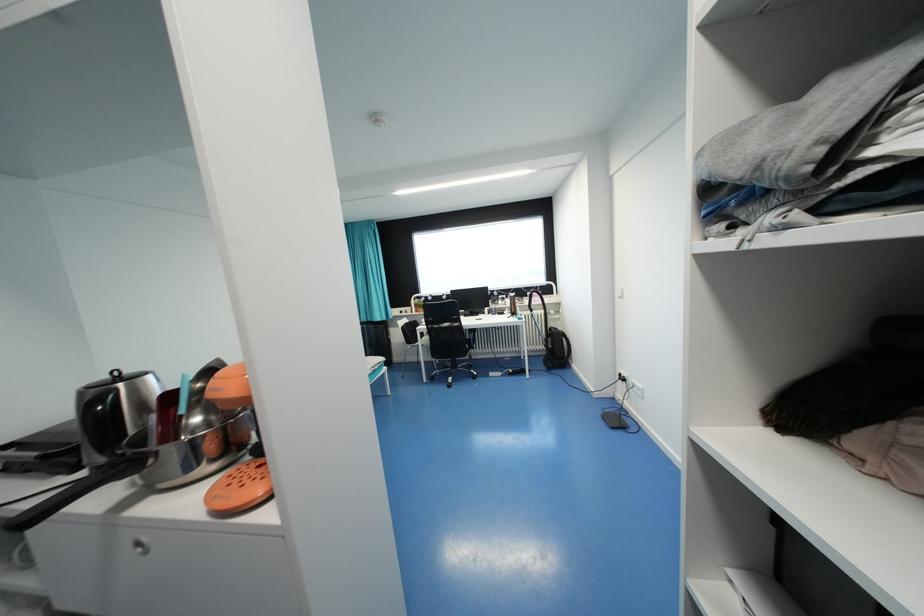
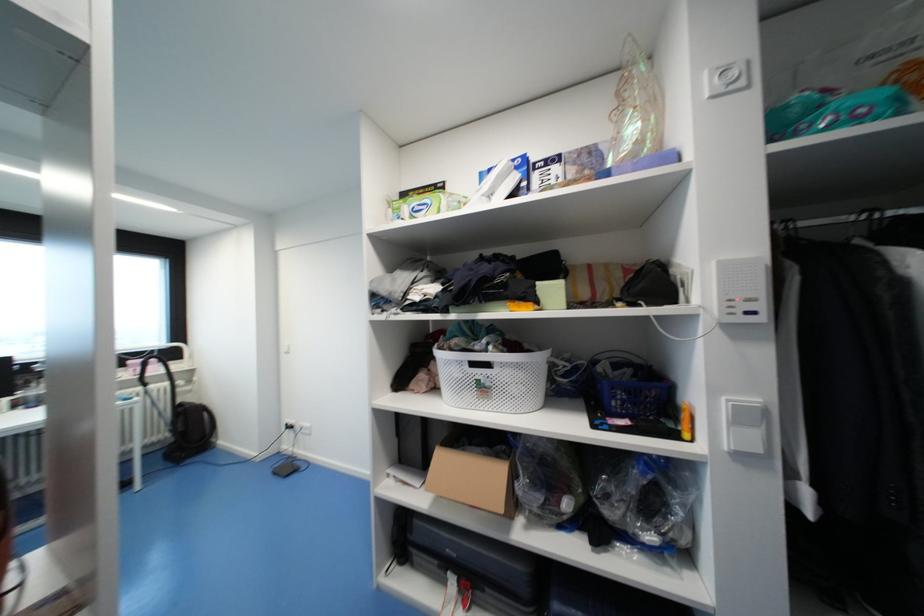
Where in the second image is the point corresponding to the point at 541,302 from the first image?

(160, 371)